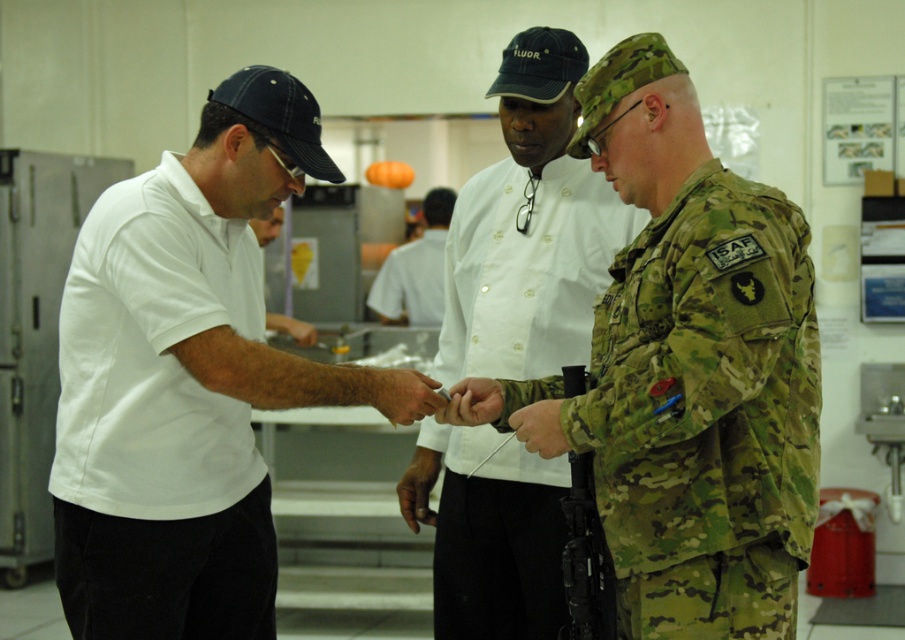
Is camouflage uniform at center bigger than camouflage fabric at center?

Yes, camouflage uniform at center is bigger than camouflage fabric at center.

This screenshot has height=640, width=905. What are the coordinates of `camouflage uniform at center` in the screenshot? It's located at (693, 369).

You are a GUI agent. You are given a task and a screenshot of the screen. Output one action in this format:
    pyautogui.click(x=<x>, y=<y>)
    Task: Click on the camouflage uniform at center
    Image resolution: width=905 pixels, height=640 pixels.
    Given the screenshot: What is the action you would take?
    pyautogui.click(x=693, y=369)

Is white matte shirt at left wider than white button-up shirt at center?

Correct, the width of white matte shirt at left exceeds that of white button-up shirt at center.

Is white matte shirt at left positioned in front of white button-up shirt at center?

Yes, white matte shirt at left is in front of white button-up shirt at center.

Is point (312, 131) in front of point (420, 259)?

That is True.

At what (x,y) coordinates should I click in order to perform the action: click on white matte shirt at left. Please return your answer as a coordinate pair (x, y). Looking at the image, I should click on (182, 380).

Is white button-up shirt at center wider than camouflage fabric at center?

Correct, the width of white button-up shirt at center exceeds that of camouflage fabric at center.

Can you confirm if white button-up shirt at center is positioned above camouflage fabric at center?

Indeed, white button-up shirt at center is positioned over camouflage fabric at center.

Is point (388, 300) farther from viewer compared to point (559, 422)?

Yes, point (388, 300) is behind point (559, 422).

This screenshot has height=640, width=905. Identify the location of white button-up shirt at center. (415, 269).